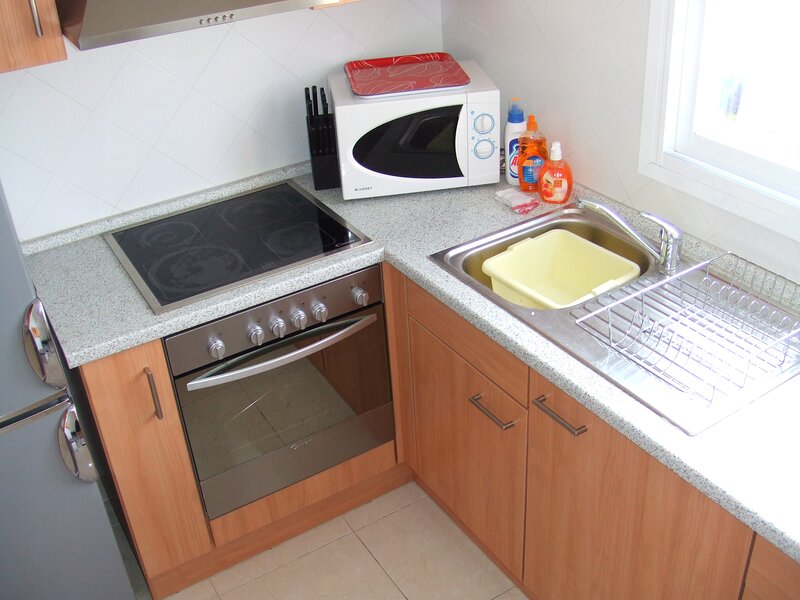
Find the location of a particular element. The width and height of the screenshot is (800, 600). cabinet door 2 is located at coordinates click(x=458, y=467).